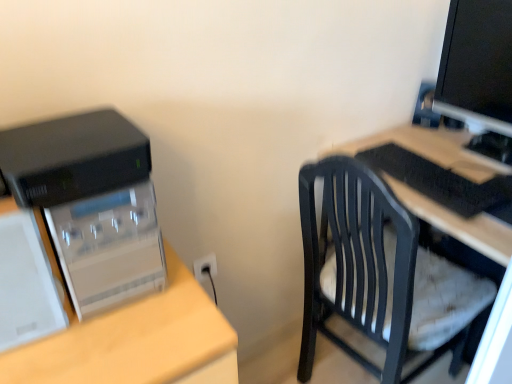
Locate an element on the screen. The image size is (512, 384). blank space above black plastic chair at right (from a real-world perspective) is located at coordinates (452, 172).